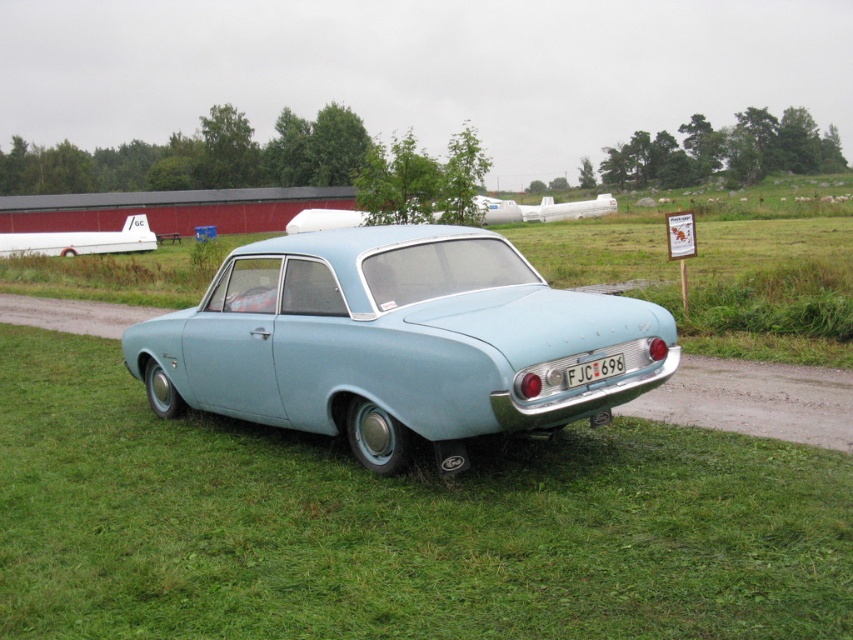
You are a photographer planning to take a photo of the light blue matte car at center and the white plastic license plate at center. Since you want to capture both in the frame, which object should you focus on first to ensure proper focus? Explain your reasoning based on their sizes in the image.

The light blue matte car at center is much taller than the white plastic license plate at center. Therefore, you should focus on the light blue matte car at center first because it occupies more space in the frame, ensuring that the larger object is in focus before adjusting for the smaller one.

You are a photographer trying to capture the light blue matte car at center and the white plastic license plate at center in a single shot. Can you position yourself so that both are visible without any obstruction?

The light blue matte car at center is in front of the white plastic license plate at center, so positioning yourself to capture both without obstruction would require angling the camera so the car does not block the license plate.